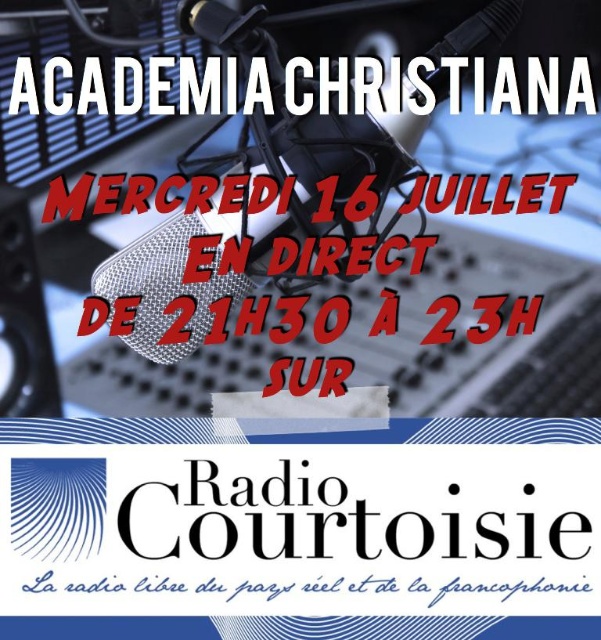
Can you confirm if white metallic text at upper center is thinner than blue handwritten text at lower center?

No, white metallic text at upper center is not thinner than blue handwritten text at lower center.

Which is above, white metallic text at upper center or blue handwritten text at lower center?

white metallic text at upper center

You are a GUI agent. You are given a task and a screenshot of the screen. Output one action in this format:
    pyautogui.click(x=<x>, y=<y>)
    Task: Click on the white metallic text at upper center
    The height and width of the screenshot is (640, 601).
    Given the screenshot: What is the action you would take?
    pyautogui.click(x=166, y=86)